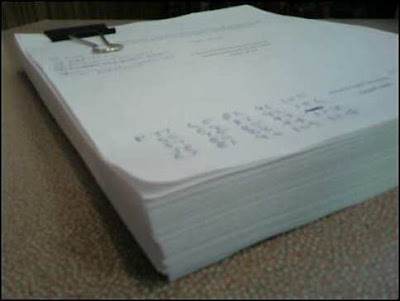
The height and width of the screenshot is (301, 400). Identify the location of brown walls. (22, 16), (127, 10), (336, 8).